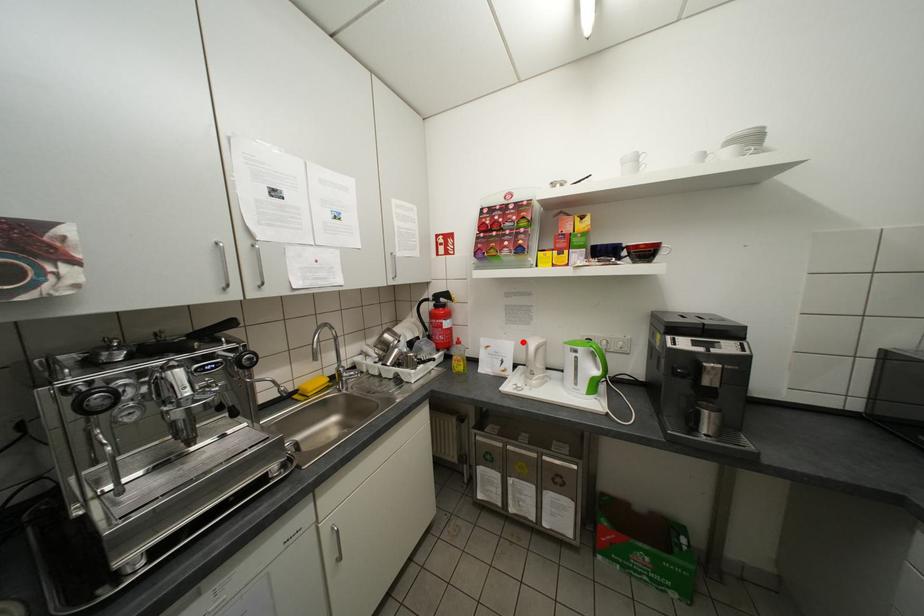
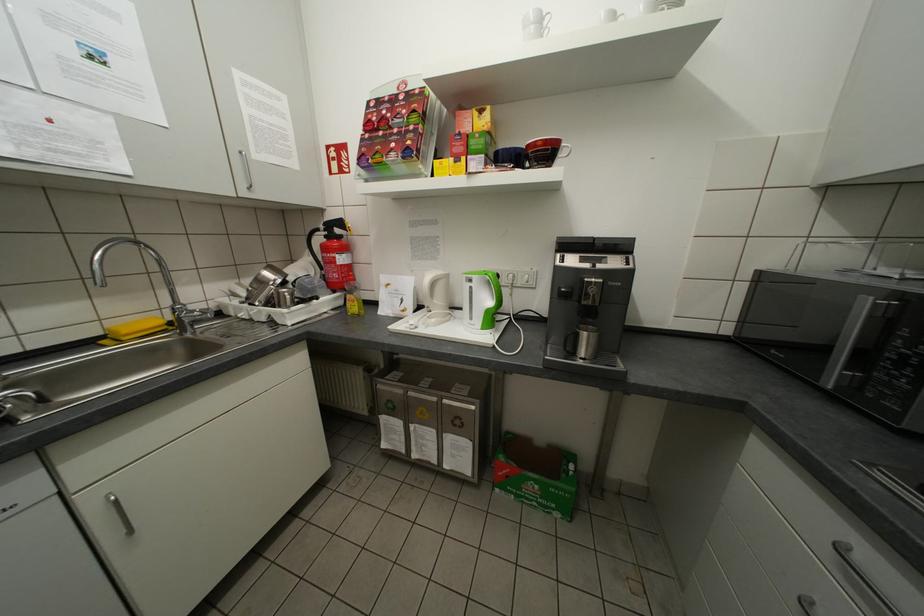
The point at the highlighted location is marked in the first image. Where is the corresponding point in the second image?

(423, 277)